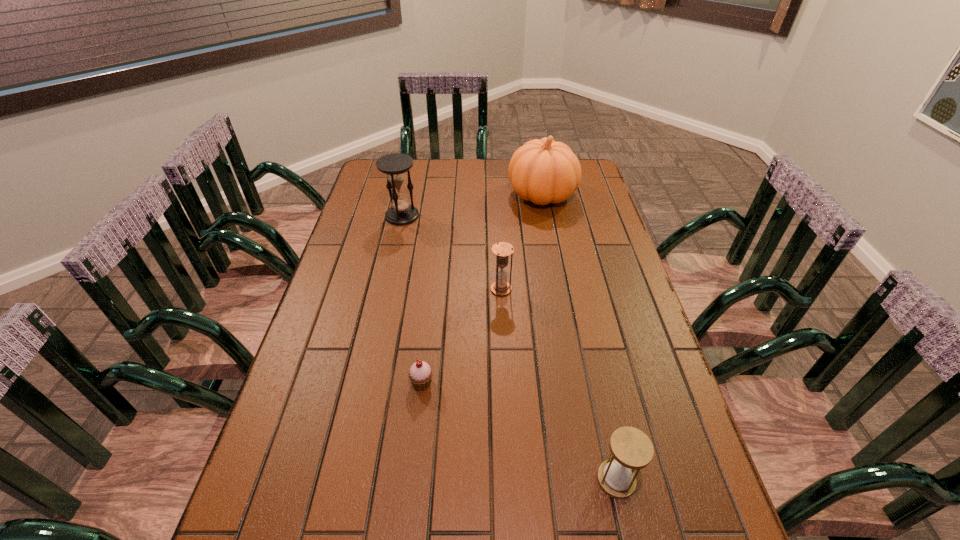
The image size is (960, 540). Find the location of `free point between the pumpkin and the rightmost hourglass`. free point between the pumpkin and the rightmost hourglass is located at coordinates (579, 337).

Image resolution: width=960 pixels, height=540 pixels. I want to click on empty space that is in between the farthest hourglass and the rightmost hourglass, so (x=509, y=348).

Locate an element on the screen. This screenshot has height=540, width=960. free area in between the pumpkin and the nearest object is located at coordinates (579, 337).

Select which object is the third closest to the fourth farthest object. Please provide its 2D coordinates. Your answer should be formatted as a tuple, i.e. [(x, y)], where the tuple contains the x and y coordinates of a point satisfying the conditions above.

[(395, 166)]

Select which object is the fourth closest to the fourth object from right to left. Please provide its 2D coordinates. Your answer should be formatted as a tuple, i.e. [(x, y)], where the tuple contains the x and y coordinates of a point satisfying the conditions above.

[(544, 171)]

This screenshot has height=540, width=960. Identify the location of hourglass that stands as the third closest to the pumpkin. (631, 449).

Identify which hourglass is the second nearest to the cupcake. Please provide its 2D coordinates. Your answer should be formatted as a tuple, i.e. [(x, y)], where the tuple contains the x and y coordinates of a point satisfying the conditions above.

[(631, 449)]

Where is `vacant region that satisfies the following two spatial constraints: 1. on the front side of the rightmost hourglass; 2. on the right side of the cupcake`? The image size is (960, 540). vacant region that satisfies the following two spatial constraints: 1. on the front side of the rightmost hourglass; 2. on the right side of the cupcake is located at coordinates (411, 480).

Where is `vacant space that satisfies the following two spatial constraints: 1. on the back side of the pumpkin; 2. on the right side of the second farthest hourglass`? The width and height of the screenshot is (960, 540). vacant space that satisfies the following two spatial constraints: 1. on the back side of the pumpkin; 2. on the right side of the second farthest hourglass is located at coordinates (496, 194).

This screenshot has height=540, width=960. I want to click on vacant space that satisfies the following two spatial constraints: 1. on the front side of the second nearest object; 2. on the left side of the leftmost object, so click(365, 383).